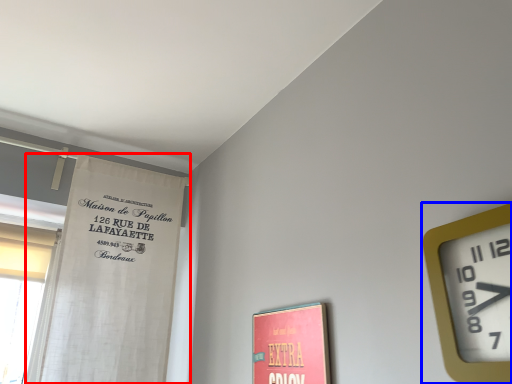
Question: Which of the following is the farthest to the observer, curtain (highlighted by a red box) or wall clock (highlighted by a blue box)?

Choices:
 (A) curtain
 (B) wall clock

Answer: (A)